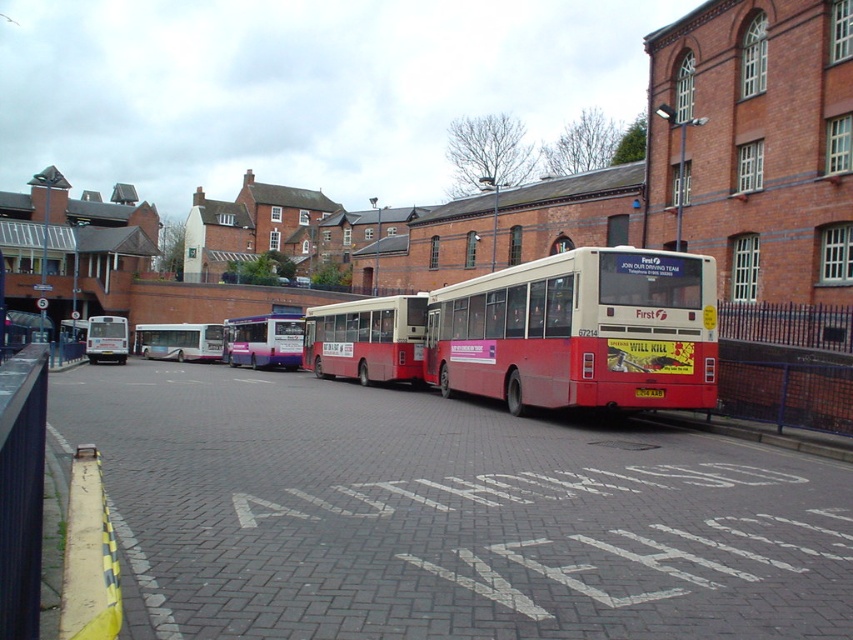
You are a delivery person needing to park your van between the purple glossy bus at center and the white glossy bus at left. Your van is 2 meters wide. Can you fit your van between them?

The purple glossy bus at center is narrower than the white glossy bus at left, so the space between them might be sufficient for a 2 meter wide van. However, without knowing the exact distance between the buses, it is uncertain if there is enough space.

You are a delivery driver who needs to park your van between the red matte bus at center and the yellow matte license plate at center. Based on the scene, can you safely park your van there without blocking the painted marking on the pavement?

The red matte bus at center is positioned on the left side of yellow matte license plate at center. Since the painted marking on the pavement reads

You are a delivery person who needs to park your van between the purple glossy bus at center and the white glossy bus at left. Given that your van is 4 meters long, can you fit it in the available space between them?

The purple glossy bus at center occupies less space than the white glossy bus at left, so the space between them may be sufficient for your 4 meter van. However, without knowing the exact distance between the buses, it is impossible to confirm if the van will fit.